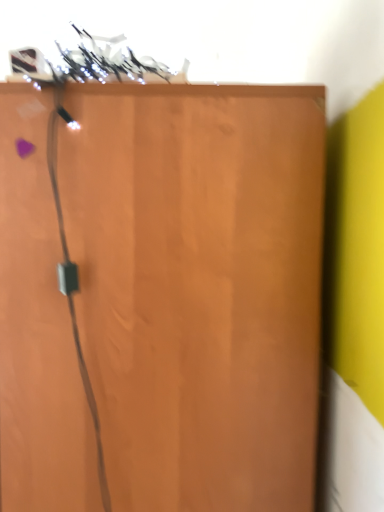
The image size is (384, 512). Describe the element at coordinates (162, 296) in the screenshot. I see `matte wood cabinet at upper center` at that location.

Locate an element on the screen. The height and width of the screenshot is (512, 384). matte wood cabinet at upper center is located at coordinates pos(162,296).

The width and height of the screenshot is (384, 512). Find the location of `matte wood cabinet at upper center`. matte wood cabinet at upper center is located at coordinates (162, 296).